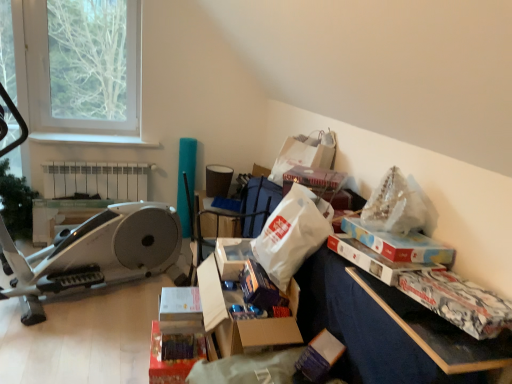
The image size is (512, 384). Identify the location of free point to the left of matte cardboard storage box at center, which is the 2th storage box from top to bottom. (117, 361).